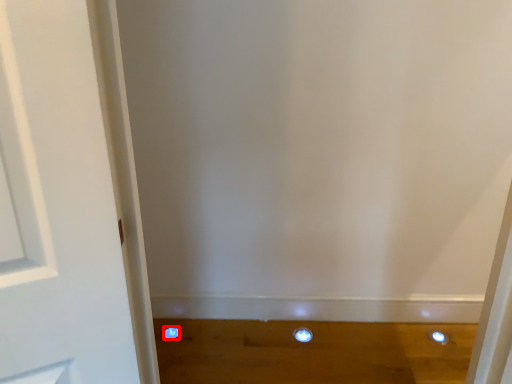
Question: From the image's perspective, what is the correct spatial relationship of dot (annotated by the red box) in relation to dot?

Choices:
 (A) below
 (B) above

Answer: (B)